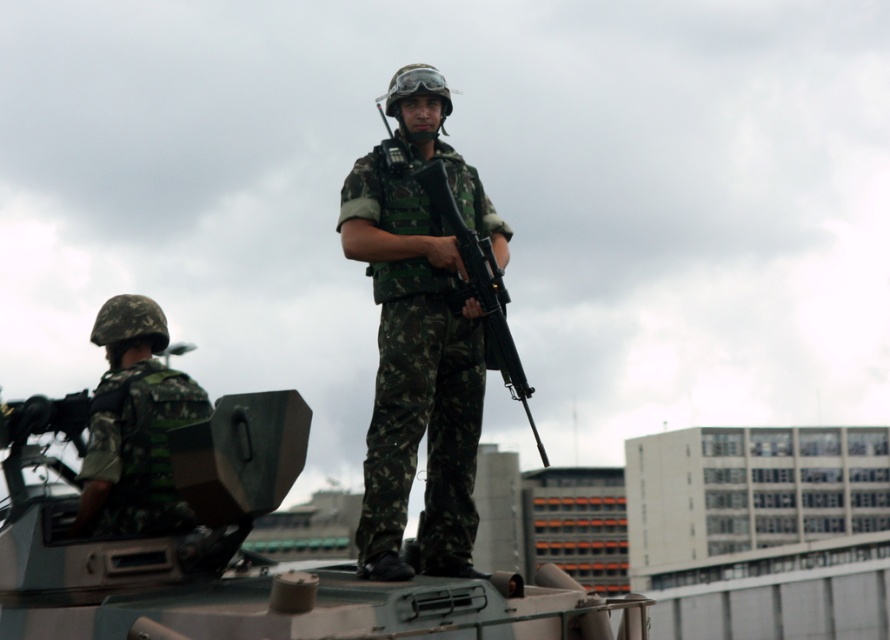
You are a military analyst assessing the positioning of the camouflage fabric tank at center and the camouflage fabric helmet at left in the image. Based on their positions, which object is located lower in the scene?

The camouflage fabric tank at center is positioned under the camouflage fabric helmet at left, so the camouflage fabric tank at center is lower in the scene.

You are a military planner assessing the visibility of equipment in an urban setting. Given the scene described, which object between the camo uniform at center and the camouflage fabric helmet at left has a greater width, potentially affecting visibility? Please base your answer on the provided description.

The camo uniform at center has a greater width than the camouflage fabric helmet at left, making it potentially more visible in the urban environment due to its larger size.

You are a military planner trying to determine the placement of equipment on a transport vehicle. You have a camouflage fabric tank at center and a camouflage fabric helmet at left. Which item should you prioritize packing first if space is limited?

The camouflage fabric tank at center is larger in size than the camouflage fabric helmet at left, so you should prioritize packing the camouflage fabric tank at center first to ensure it fits properly before the smaller helmet.